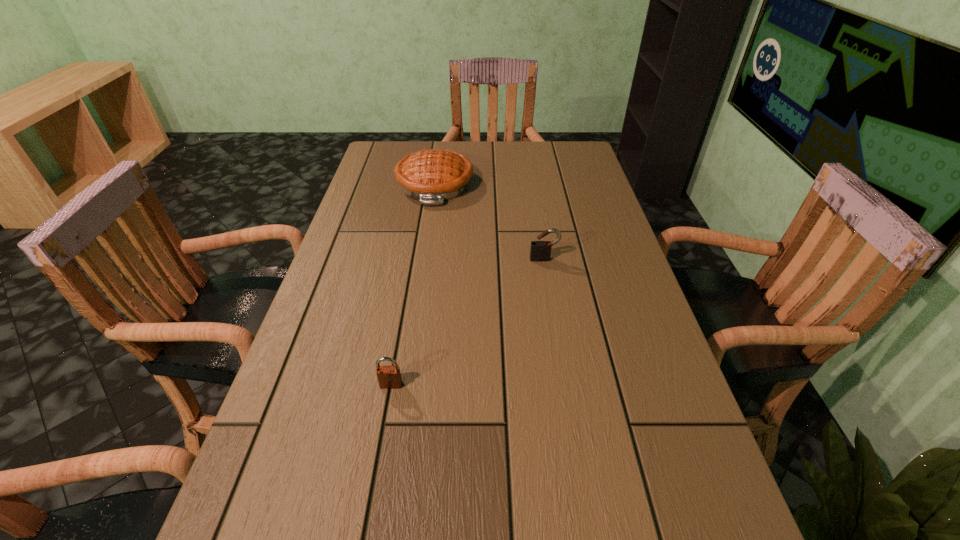
Identify the location of vacant space that's between the nearest object and the pie. (413, 285).

The image size is (960, 540). Identify the location of the closest object to the farthest object. (540, 251).

Choose which object is the nearest neighbor to the farther padlock. Please provide its 2D coordinates. Your answer should be formatted as a tuple, i.e. [(x, y)], where the tuple contains the x and y coordinates of a point satisfying the conditions above.

[(432, 176)]

You are a GUI agent. You are given a task and a screenshot of the screen. Output one action in this format:
    pyautogui.click(x=<x>, y=<y>)
    Task: Click on the padlock that is the second closest one to the farthest object
    This screenshot has height=540, width=960.
    Given the screenshot: What is the action you would take?
    pyautogui.click(x=389, y=377)

The height and width of the screenshot is (540, 960). What are the coordinates of `padlock that is the closest to the farthest object` in the screenshot? It's located at (540, 251).